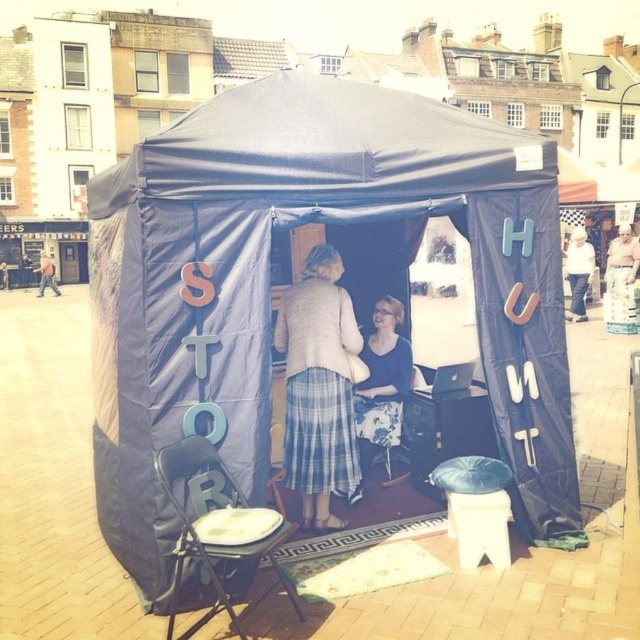
Consider the image. Between blue fabric tent at center and plaid skirt at center, which one is positioned lower?

Positioned lower is plaid skirt at center.

The height and width of the screenshot is (640, 640). What do you see at coordinates (312, 300) in the screenshot? I see `blue fabric tent at center` at bounding box center [312, 300].

Does point (337, 385) come behind point (333, 339)?

Yes, it is.

The width and height of the screenshot is (640, 640). I want to click on blue fabric tent at center, so (x=312, y=300).

Between dark blue leather stool at center and white cotton shirt at upper right, which one has less height?

Standing shorter between the two is dark blue leather stool at center.

From the picture: Can you confirm if dark blue leather stool at center is positioned above white cotton shirt at upper right?

Actually, dark blue leather stool at center is below white cotton shirt at upper right.

Who is more forward, (x=486, y=531) or (x=573, y=260)?

Positioned in front is point (x=486, y=531).

The width and height of the screenshot is (640, 640). What are the coordinates of `dark blue leather stool at center` in the screenshot? It's located at (476, 508).

Is point (628, 248) more distant than point (40, 289)?

That is False.

Which of these two, light pink fabric at upper right or matte black jacket at left, stands shorter?

With less height is matte black jacket at left.

Is point (625, 269) closer to camera compared to point (51, 266)?

That is True.

Locate an element on the screen. Image resolution: width=640 pixels, height=640 pixels. light pink fabric at upper right is located at coordinates (621, 259).